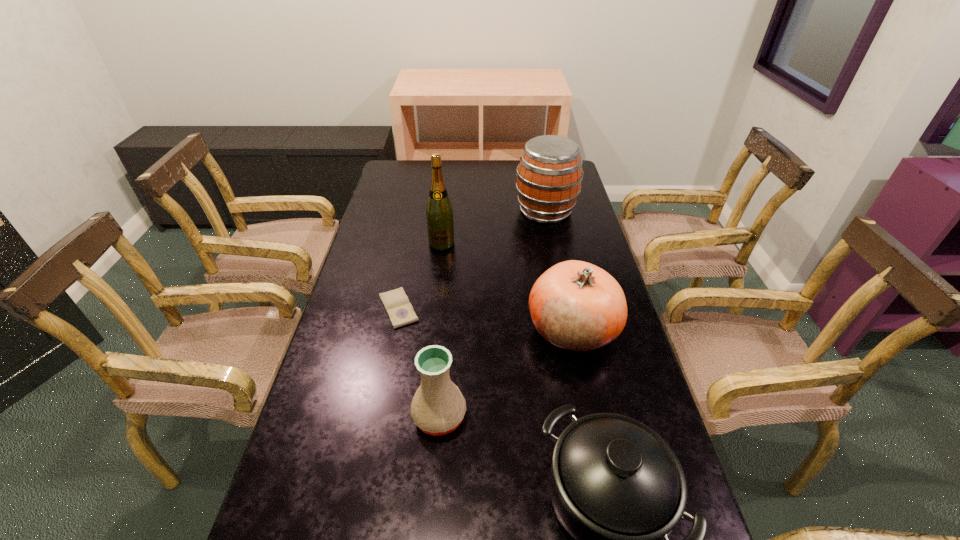
The height and width of the screenshot is (540, 960). I want to click on blank region between the tallest object and the pumpkin, so click(x=507, y=286).

Locate an element on the screen. This screenshot has height=540, width=960. vacant area between the pottery and the cider is located at coordinates click(492, 313).

The image size is (960, 540). What are the coordinates of `free spot between the cider and the pottery` in the screenshot? It's located at (492, 313).

Where is `vacant area between the diary and the pumpkin`? vacant area between the diary and the pumpkin is located at coordinates (485, 319).

Locate which object is the second closest to the pumpkin. Please provide its 2D coordinates. Your answer should be formatted as a tuple, i.e. [(x, y)], where the tuple contains the x and y coordinates of a point satisfying the conditions above.

[(618, 489)]

Identify the location of the fourth closest object to the diary. Image resolution: width=960 pixels, height=540 pixels. (618, 489).

Where is `blank area in the image that satisfies the following two spatial constraints: 1. on the front side of the pumpkin; 2. on the right side of the cider`? Image resolution: width=960 pixels, height=540 pixels. blank area in the image that satisfies the following two spatial constraints: 1. on the front side of the pumpkin; 2. on the right side of the cider is located at coordinates (570, 329).

Locate an element on the screen. vacant position in the image that satisfies the following two spatial constraints: 1. on the front-facing side of the wine bottle; 2. on the right side of the pumpkin is located at coordinates (432, 329).

You are a GUI agent. You are given a task and a screenshot of the screen. Output one action in this format:
    pyautogui.click(x=<x>, y=<y>)
    Task: Click on the free space that satisfies the following two spatial constraints: 1. on the front-facing side of the tallest object; 2. on the right side of the pumpkin
    This screenshot has height=540, width=960.
    Given the screenshot: What is the action you would take?
    pyautogui.click(x=432, y=329)

At what (x,y) coordinates should I click in order to perform the action: click on vacant point that satisfies the following two spatial constraints: 1. on the front-facing side of the tallest object; 2. on the right side of the pottery. Please return your answer as a coordinate pair (x, y). The image size is (960, 540). Looking at the image, I should click on (422, 416).